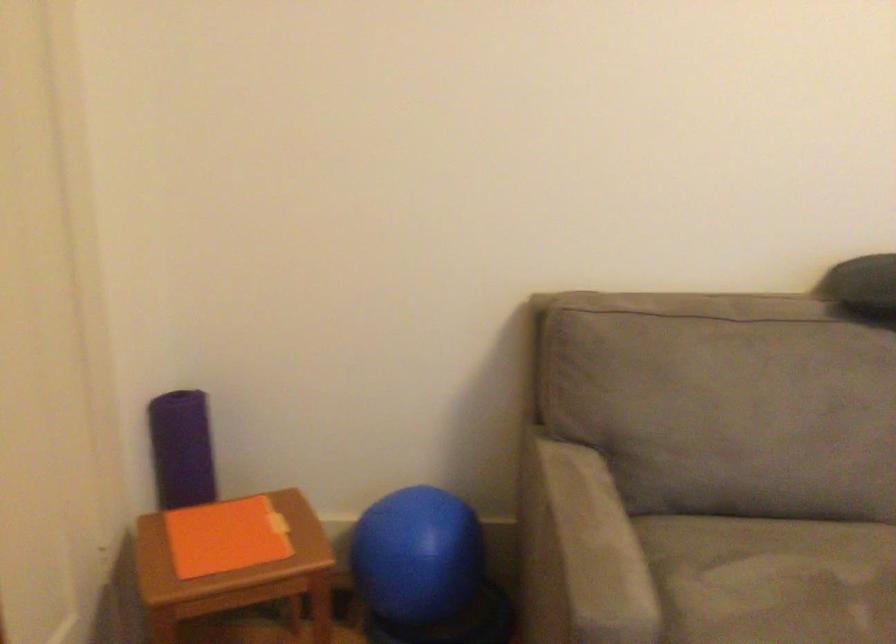
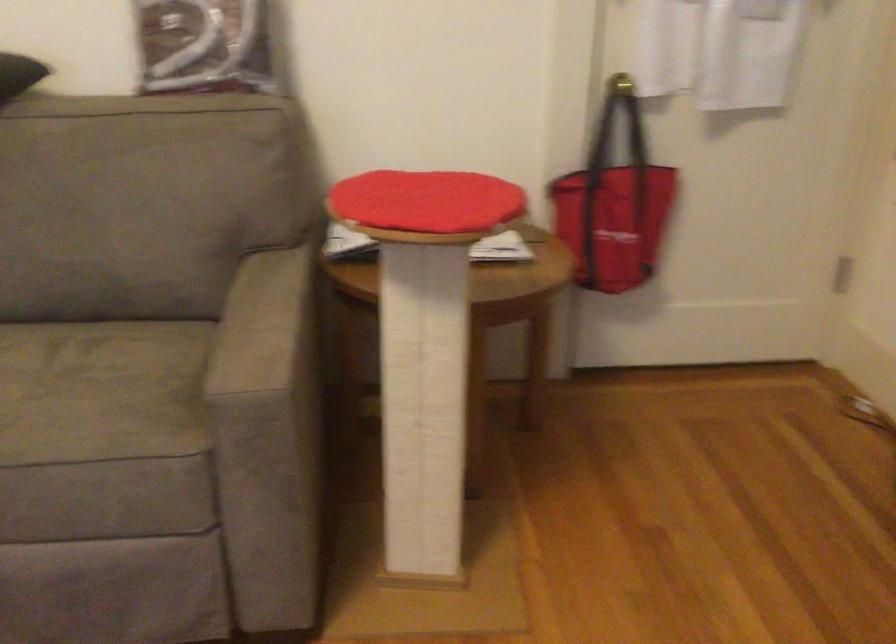
Question: In a continuous first-person perspective shot, in which direction is the camera moving?

Choices:
 (A) Left
 (B) Right
 (C) Forward
 (D) Backward

Answer: (B)